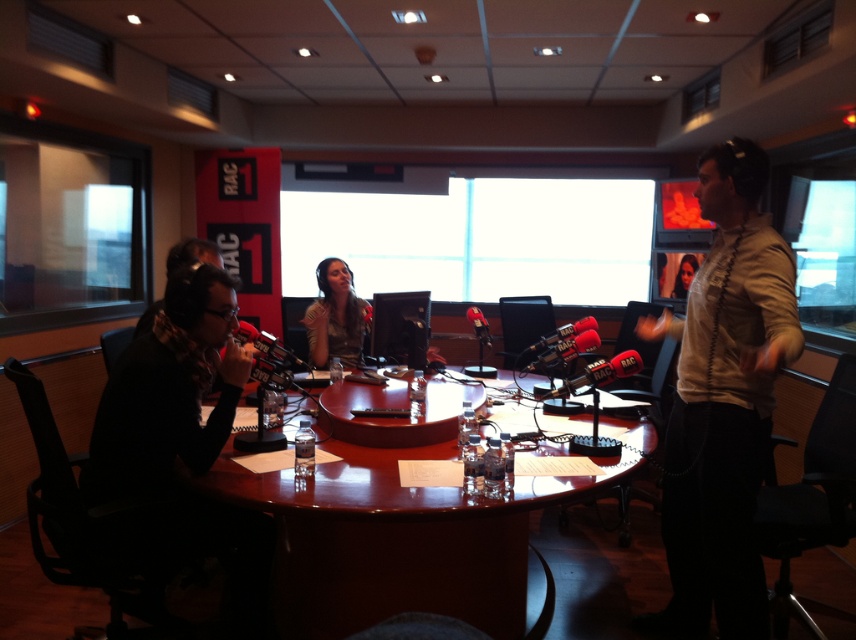
Looking at this image, who is positioned more to the left, light beige shirt at right or striped fabric shirt at center?

striped fabric shirt at center

Who is more distant from viewer, (738, 547) or (348, 321)?

The point (348, 321) is behind.

You are a GUI agent. You are given a task and a screenshot of the screen. Output one action in this format:
    pyautogui.click(x=<x>, y=<y>)
    Task: Click on the light beige shirt at right
    The height and width of the screenshot is (640, 856).
    Given the screenshot: What is the action you would take?
    [x=724, y=401]

Is striped fabric shirt at center wider than matte black hair at center?

Indeed, striped fabric shirt at center has a greater width compared to matte black hair at center.

Can you confirm if striped fabric shirt at center is positioned to the left of matte black hair at center?

Correct, you'll find striped fabric shirt at center to the left of matte black hair at center.

Where is `striped fabric shirt at center`? This screenshot has height=640, width=856. striped fabric shirt at center is located at coordinates click(334, 316).

Which is more to the right, brown wooden table at center or matte black hair at center?

From the viewer's perspective, matte black hair at center appears more on the right side.

Measure the distance between point (389,573) and camera.

The distance of point (389,573) from camera is 2.20 meters.

Locate an element on the screen. The height and width of the screenshot is (640, 856). brown wooden table at center is located at coordinates (391, 540).